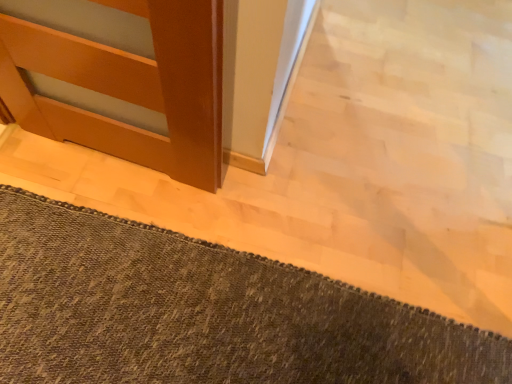
Where is `empty space that is ontop of brown woven rug at lower left (from a real-world perspective)`? empty space that is ontop of brown woven rug at lower left (from a real-world perspective) is located at coordinates (189, 317).